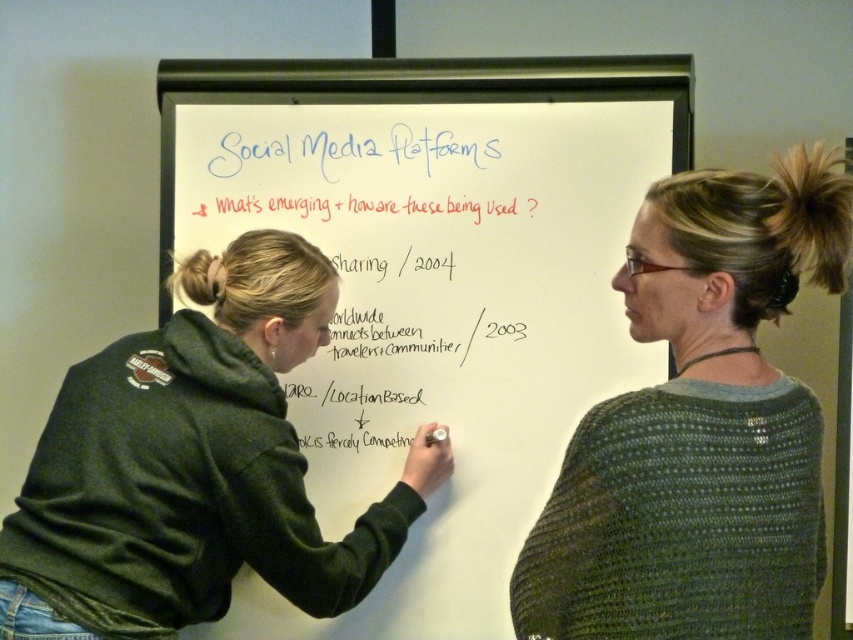
Question: Estimate the real-world distances between objects in this image. Which object is closer to the whiteboard at center?

Choices:
 (A) green knitted sweater at upper right
 (B) dark green hoodie at left

Answer: (B)

Question: Is whiteboard at center in front of dark green hoodie at left?

Choices:
 (A) yes
 (B) no

Answer: (B)

Question: Which of the following is the farthest from the observer?

Choices:
 (A) (601, 604)
 (B) (271, 365)
 (C) (340, 348)

Answer: (C)

Question: Can you confirm if green knitted sweater at upper right is positioned above dark green hoodie at left?

Choices:
 (A) yes
 (B) no

Answer: (A)

Question: Which object is farther from the camera taking this photo?

Choices:
 (A) dark green hoodie at left
 (B) whiteboard at center
 (C) green knitted sweater at upper right

Answer: (B)

Question: Is green knitted sweater at upper right below dark green hoodie at left?

Choices:
 (A) no
 (B) yes

Answer: (A)